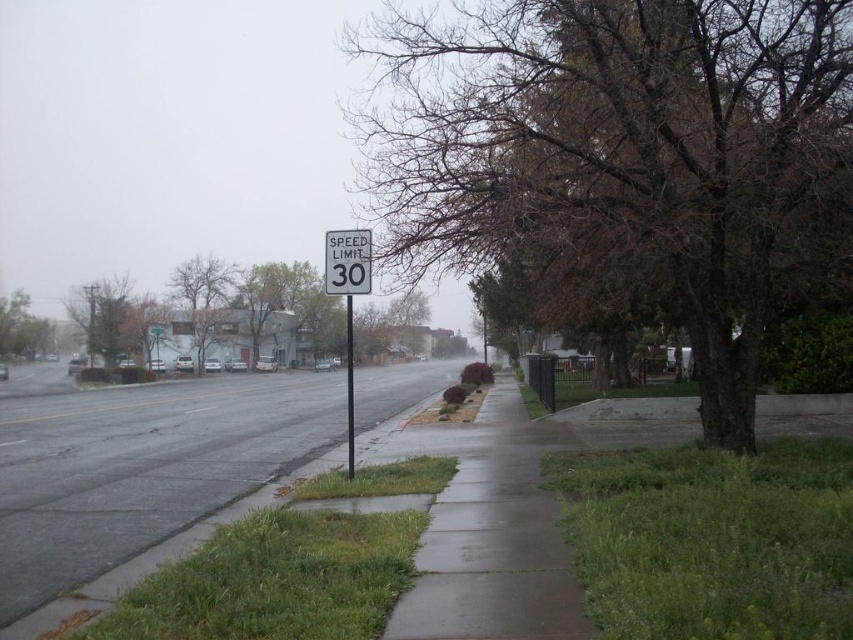
You are standing on the sidewalk in the image and want to step onto the green grass at lower right. Based on the coordinates provided, how far to your right should you move to reach the grass?

The green grass at lower right is located at coordinate point 0.844 on the x and 0.836 on the y axis. To reach it from the sidewalk, you should move approximately 0.844 units to the right.

You are a delivery person trying to place a large box on the smooth concrete sidewalk at center and the white plastic speed limit sign at center. Which surface can you place the box on without it falling off?

The smooth concrete sidewalk at center is bigger than the white plastic speed limit sign at center, so you can place the box on the smooth concrete sidewalk at center without it falling off.

You are a delivery person with a 1.5 meter wide cart. You need to navigate through the smooth concrete sidewalk at center and the white plastic speed limit sign at center. Can your cart pass through the narrowest point between them?

The smooth concrete sidewalk at center is wider than the white plastic speed limit sign at center. Therefore, the narrowest point between them is the width of the white plastic speed limit sign at center. Since the cart is 1.5 meters wide, it can pass through as long as the sign is wider than 1.5 meters. However, since the exact width of the sign isn